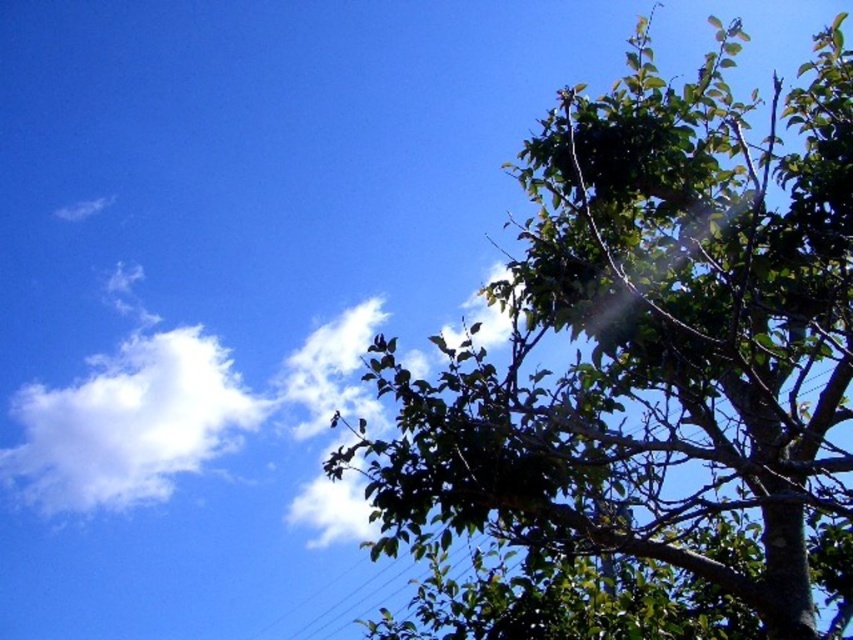
You are standing in the middle of the scene and want to walk towards the nearest point between point (611,179) and point (32,412). Which point should you head towards first?

Point (611,179) is closer to the viewer than point (32,412), so you should head towards point (611,179) first.